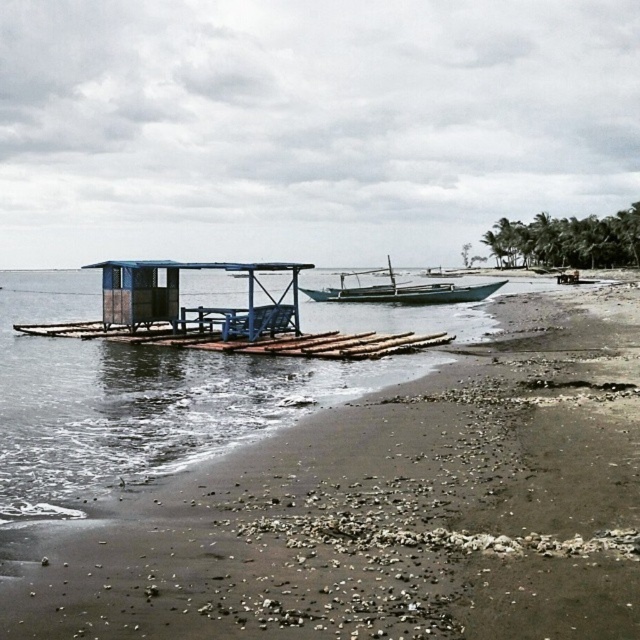
Question: Is the position of brown sandy beach at lower left more distant than that of wooden boat at center?

Choices:
 (A) no
 (B) yes

Answer: (A)

Question: Which of the following is the farthest from the observer?

Choices:
 (A) (257, 595)
 (B) (385, 292)

Answer: (B)

Question: Considering the relative positions of brown sandy beach at lower left and wooden boat at center in the image provided, where is brown sandy beach at lower left located with respect to wooden boat at center?

Choices:
 (A) above
 (B) below

Answer: (B)

Question: Is brown sandy beach at lower left to the left of wooden boat at center from the viewer's perspective?

Choices:
 (A) no
 (B) yes

Answer: (B)